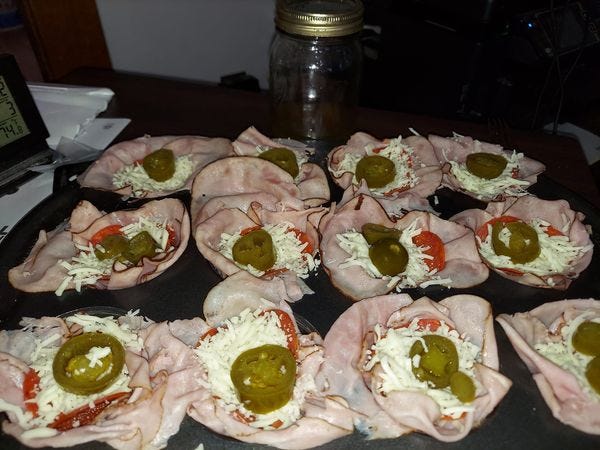
Identify the location of digital clock. (40, 136).